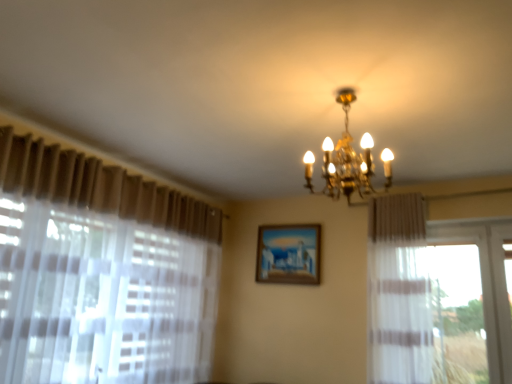
Where is `wooden painted picture frame at center`? This screenshot has height=384, width=512. wooden painted picture frame at center is located at coordinates (288, 254).

Image resolution: width=512 pixels, height=384 pixels. Describe the element at coordinates (288, 254) in the screenshot. I see `wooden painted picture frame at center` at that location.

What do you see at coordinates (347, 159) in the screenshot?
I see `gold metallic chandelier at upper center` at bounding box center [347, 159].

Measure the distance between gold metallic chandelier at upper center and camera.

gold metallic chandelier at upper center is 2.22 meters away from camera.

This screenshot has height=384, width=512. I want to click on gold metallic chandelier at upper center, so click(347, 159).

What are the coordinates of `wooden painted picture frame at center` in the screenshot? It's located at (288, 254).

Is wooden painted picture frame at center to the right of gold metallic chandelier at upper center from the viewer's perspective?

No, wooden painted picture frame at center is not to the right of gold metallic chandelier at upper center.

Which object is closer to the camera, wooden painted picture frame at center or gold metallic chandelier at upper center?

Positioned in front is gold metallic chandelier at upper center.

Considering the positions of points (305, 277) and (388, 158), is point (305, 277) closer to camera compared to point (388, 158)?

No, (305, 277) is behind (388, 158).

From the image's perspective, is wooden painted picture frame at center above or below gold metallic chandelier at upper center?

wooden painted picture frame at center is situated lower than gold metallic chandelier at upper center in the image.

From a real-world perspective, which object rests below the other?

From a 3D spatial view, wooden painted picture frame at center is below.

Considering the relative sizes of wooden painted picture frame at center and gold metallic chandelier at upper center in the image provided, is wooden painted picture frame at center thinner than gold metallic chandelier at upper center?

Yes, wooden painted picture frame at center is thinner than gold metallic chandelier at upper center.

From the picture: Who is taller, wooden painted picture frame at center or gold metallic chandelier at upper center?

gold metallic chandelier at upper center.

Considering the sizes of objects wooden painted picture frame at center and gold metallic chandelier at upper center in the image provided, who is smaller, wooden painted picture frame at center or gold metallic chandelier at upper center?

Smaller between the two is wooden painted picture frame at center.

In the scene shown: Is wooden painted picture frame at center located outside gold metallic chandelier at upper center?

Yes.

Based on the photo, is wooden painted picture frame at center with gold metallic chandelier at upper center?

They are not placed beside each other.

Is gold metallic chandelier at upper center at the back of wooden painted picture frame at center?

That's not correct — wooden painted picture frame at center is not looking away from gold metallic chandelier at upper center.

How distant is wooden painted picture frame at center from gold metallic chandelier at upper center?

wooden painted picture frame at center is 3.74 feet from gold metallic chandelier at upper center.

At what (x,y) coordinates should I click in order to perform the action: click on picture frame behind the gold metallic chandelier at upper center. Please return your answer as a coordinate pair (x, y). Image resolution: width=512 pixels, height=384 pixels. Looking at the image, I should click on (288, 254).

Between gold metallic chandelier at upper center and wooden painted picture frame at center, which one appears on the left side from the viewer's perspective?

From the viewer's perspective, wooden painted picture frame at center appears more on the left side.

Does gold metallic chandelier at upper center come in front of wooden painted picture frame at center?

Yes, it is.

Does point (348, 137) lie in front of point (266, 239)?

Yes, point (348, 137) is closer to viewer.

From the image's perspective, between gold metallic chandelier at upper center and wooden painted picture frame at center, who is located below?

From the image's view, wooden painted picture frame at center is below.

From a real-world perspective, does gold metallic chandelier at upper center sit lower than wooden painted picture frame at center?

No.

Considering the relative sizes of gold metallic chandelier at upper center and wooden painted picture frame at center in the image provided, is gold metallic chandelier at upper center wider than wooden painted picture frame at center?

Indeed, gold metallic chandelier at upper center has a greater width compared to wooden painted picture frame at center.

Is gold metallic chandelier at upper center shorter than wooden painted picture frame at center?

Incorrect, the height of gold metallic chandelier at upper center does not fall short of that of wooden painted picture frame at center.

Is gold metallic chandelier at upper center smaller than wooden painted picture frame at center?

Incorrect, gold metallic chandelier at upper center is not smaller in size than wooden painted picture frame at center.

Is wooden painted picture frame at center surrounded by gold metallic chandelier at upper center?

No, wooden painted picture frame at center is not a part of gold metallic chandelier at upper center.

In the scene shown: Is gold metallic chandelier at upper center positioned far away from wooden painted picture frame at center?

gold metallic chandelier at upper center is positioned a significant distance from wooden painted picture frame at center.

Does gold metallic chandelier at upper center turn towards wooden painted picture frame at center?

No.

How many degrees apart are the facing directions of gold metallic chandelier at upper center and wooden painted picture frame at center?

gold metallic chandelier at upper center and wooden painted picture frame at center are facing 90.6 degrees away from each other.

This screenshot has width=512, height=384. Identify the location of lamp that appears in front of the wooden painted picture frame at center. (347, 159).

Image resolution: width=512 pixels, height=384 pixels. Identify the location of picture frame below the gold metallic chandelier at upper center (from the image's perspective). 288,254.

You are a GUI agent. You are given a task and a screenshot of the screen. Output one action in this format:
    pyautogui.click(x=<x>, y=<y>)
    Task: Click on the picture frame behind the gold metallic chandelier at upper center
    
    Given the screenshot: What is the action you would take?
    pyautogui.click(x=288, y=254)